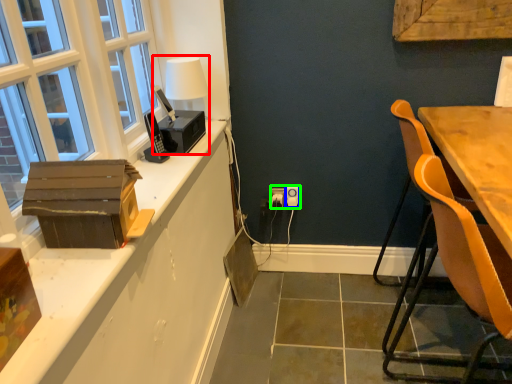
Question: Based on their relative distances, which object is nearer to table lamp (highlighted by a red box)? Choose from power outlet (highlighted by a blue box) and electric outlet (highlighted by a green box).

Choices:
 (A) power outlet
 (B) electric outlet

Answer: (B)